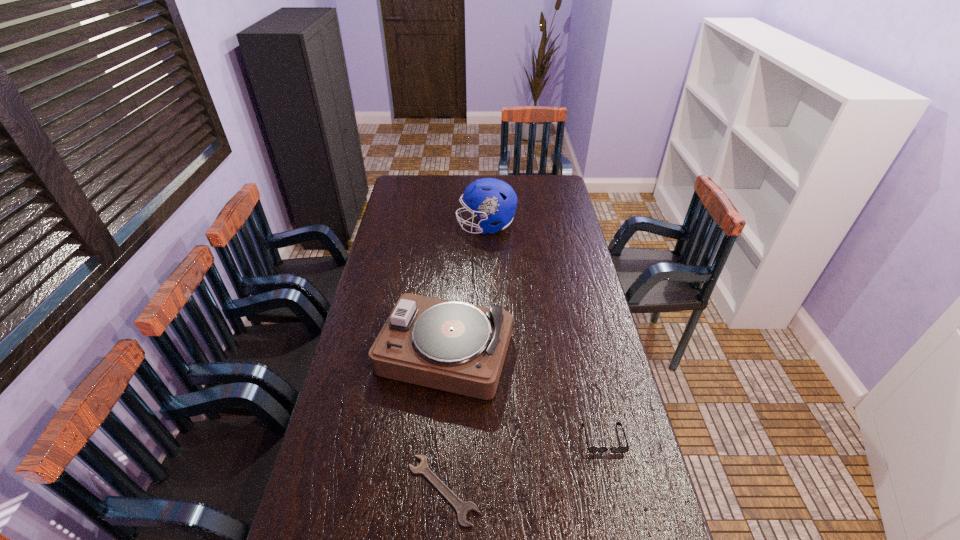
Find the location of a particular element. The width and height of the screenshot is (960, 540). free space located 0.230m on the face guard of the football helmet is located at coordinates (407, 226).

I want to click on free space located 0.120m on the front of the record player, so click(x=435, y=438).

Locate an element on the screen. free space located on the front-facing side of the second shortest object is located at coordinates (618, 503).

Where is `vacant region located on the right of the shortest object`? vacant region located on the right of the shortest object is located at coordinates (620, 490).

The height and width of the screenshot is (540, 960). What are the coordinates of `object positioned at the left edge` in the screenshot? It's located at (452, 346).

This screenshot has height=540, width=960. I want to click on object at the right edge, so click(x=591, y=449).

In the image, there is a desktop. What are the coordinates of `free space at the far edge` in the screenshot? It's located at pyautogui.click(x=531, y=192).

You are a GUI agent. You are given a task and a screenshot of the screen. Output one action in this format:
    pyautogui.click(x=<x>, y=<y>)
    Task: Click on the free space at the left edge of the desktop
    The width and height of the screenshot is (960, 540).
    Given the screenshot: What is the action you would take?
    pyautogui.click(x=403, y=273)

In the image, there is a desktop. At what (x,y) coordinates should I click in order to perform the action: click on vacant space at the right edge. Please return your answer as a coordinate pair (x, y). The width and height of the screenshot is (960, 540). Looking at the image, I should click on (578, 303).

In the image, there is a desktop. Identify the location of vacant area at the far right corner. (553, 177).